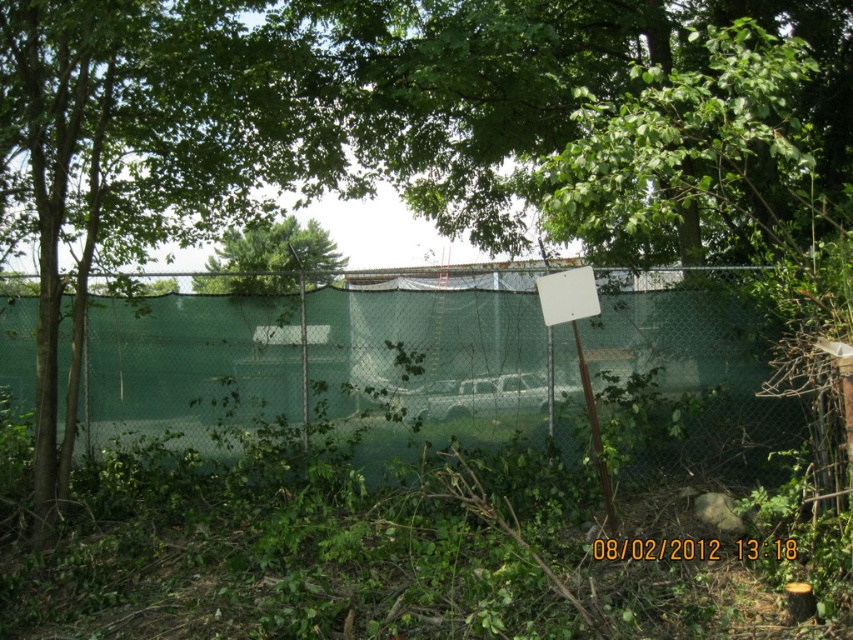
Who is taller, green mesh fence at center or green leafy tree at center?

green mesh fence at center is taller.

This screenshot has height=640, width=853. What do you see at coordinates (427, 353) in the screenshot? I see `green mesh fence at center` at bounding box center [427, 353].

Describe the element at coordinates (427, 353) in the screenshot. I see `green mesh fence at center` at that location.

Find the location of `green mesh fence at center`. green mesh fence at center is located at coordinates (427, 353).